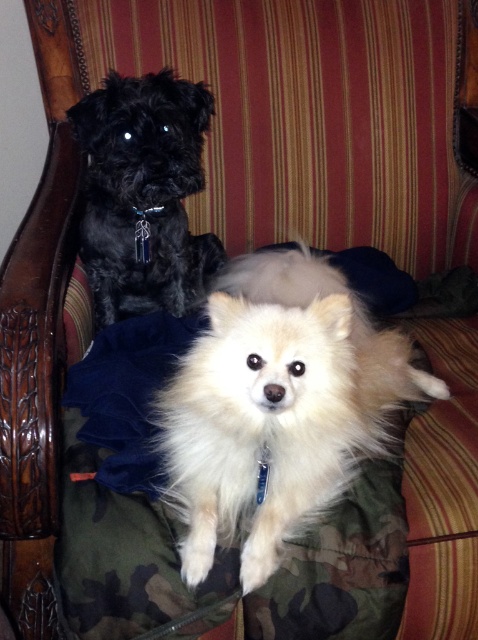
Question: Among these points, which one is farthest from the camera?

Choices:
 (A) (239, 518)
 (B) (134, 163)

Answer: (B)

Question: Among these points, which one is farthest from the camera?

Choices:
 (A) (123, 83)
 (B) (176, 467)

Answer: (A)

Question: Does white fluffy dog at center come in front of shiny black fur at upper left?

Choices:
 (A) no
 (B) yes

Answer: (B)

Question: Is white fluffy dog at center below shiny black fur at upper left?

Choices:
 (A) yes
 (B) no

Answer: (A)

Question: Is white fluffy dog at center bigger than shiny black fur at upper left?

Choices:
 (A) yes
 (B) no

Answer: (A)